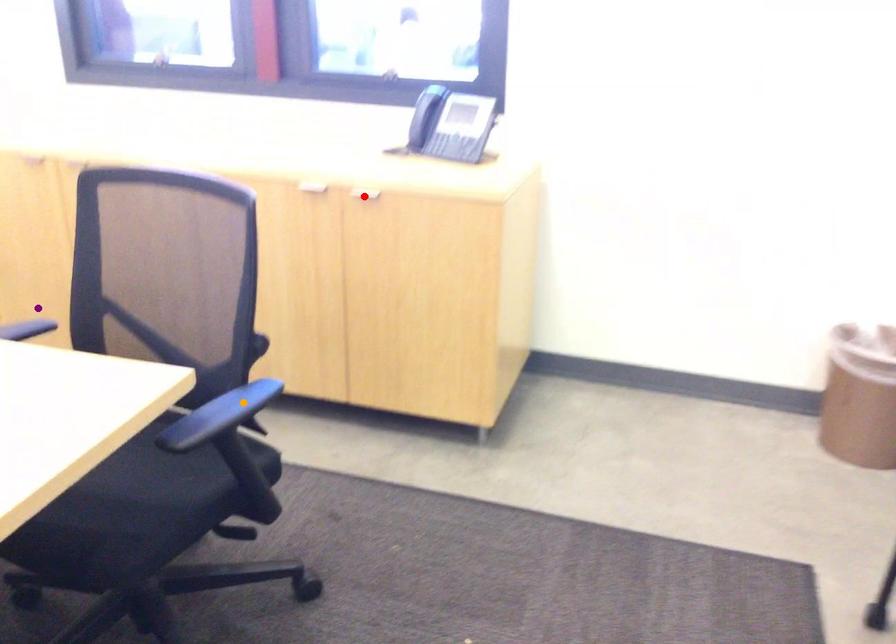
Order these from nearest to farthest:
A) orange point
B) purple point
C) red point

orange point < red point < purple point